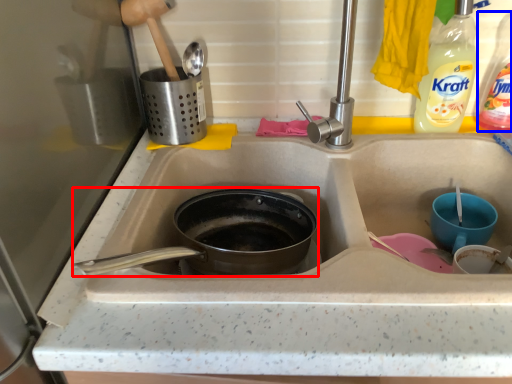
Question: Which point is further to the camera, frying pan (highlighted by a red box) or bottle (highlighted by a blue box)?

Choices:
 (A) frying pan
 (B) bottle

Answer: (A)